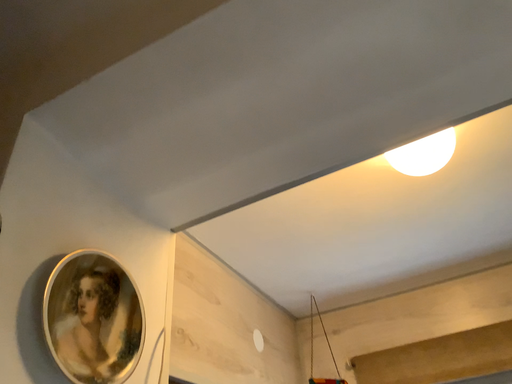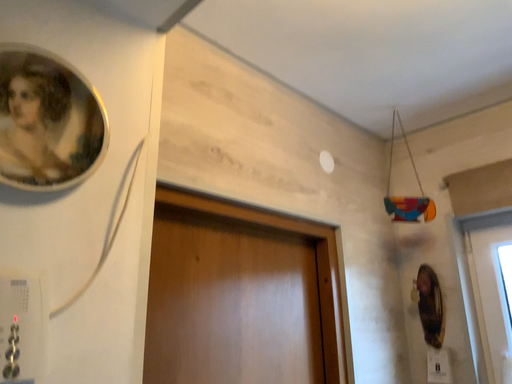
Question: How did the camera likely rotate when shooting the video?

Choices:
 (A) rotated right
 (B) rotated left

Answer: (B)